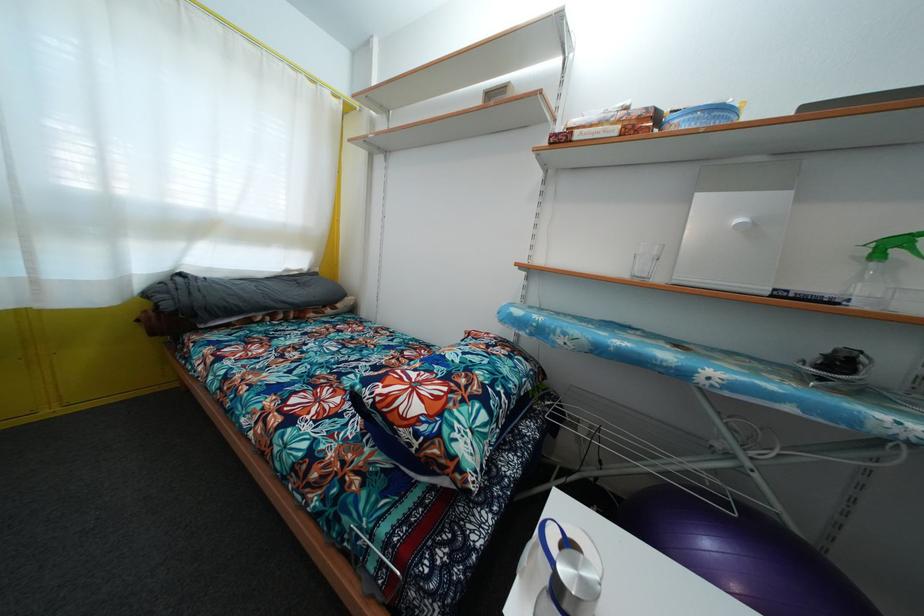
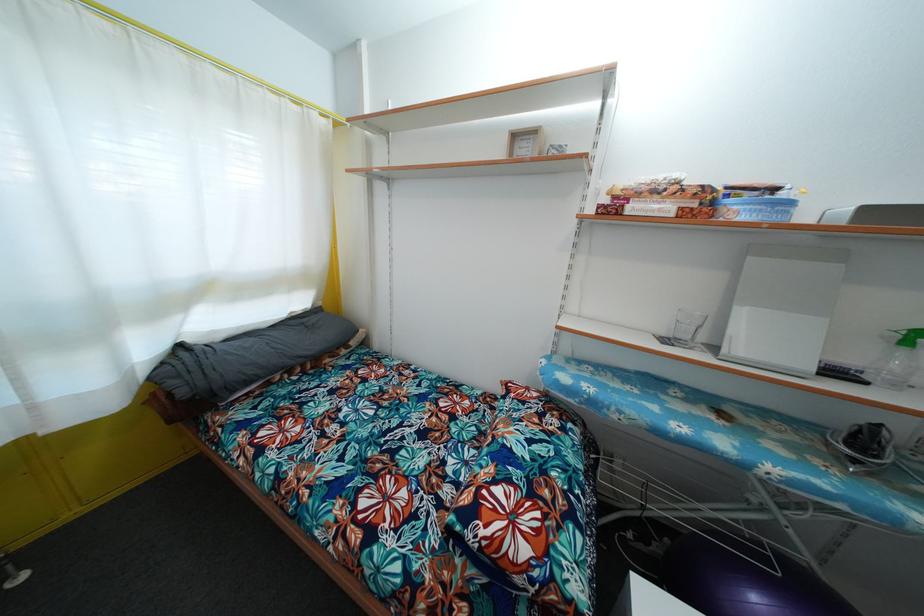
Where in the second image is the point corresponding to (x=726, y=511) from the first image?

(771, 567)